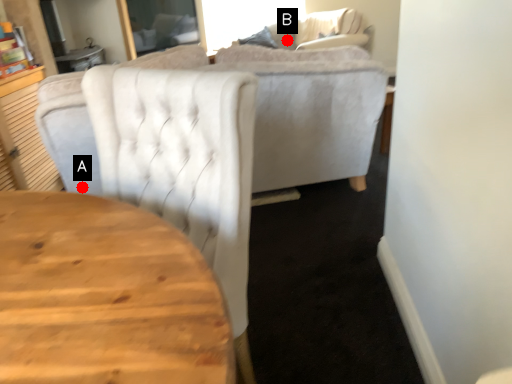
Question: Two points are circled on the image, labeled by A and B beside each circle. Which point is closer to the camera taking this photo?

Choices:
 (A) A is closer
 (B) B is closer

Answer: (A)